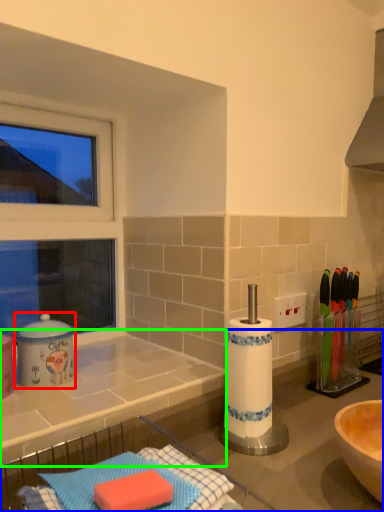
Question: Estimate the real-world distances between objects in this image. Which object is closer to appliance (highlighted by a red box), countertop (highlighted by a blue box) or countertop (highlighted by a green box)?

Choices:
 (A) countertop
 (B) countertop

Answer: (B)